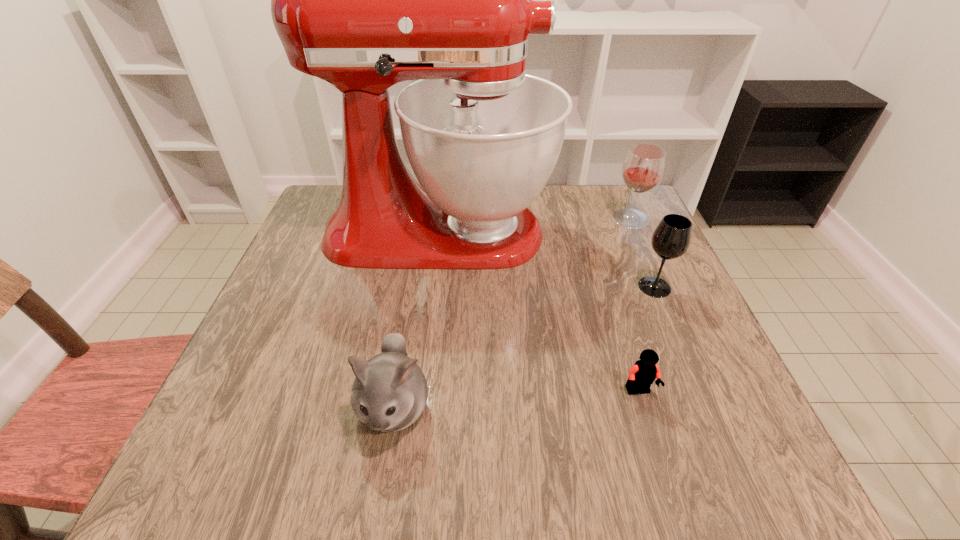
You are a GUI agent. You are given a task and a screenshot of the screen. Output one action in this format:
    pyautogui.click(x=<x>, y=<y>)
    Task: Click on the free point between the hamster and the mixer
    The image size is (960, 540).
    Given the screenshot: What is the action you would take?
    pyautogui.click(x=417, y=320)

The width and height of the screenshot is (960, 540). Find the location of `the third closest object to the nearer wineglass`. the third closest object to the nearer wineglass is located at coordinates click(x=644, y=372).

Locate which object ranks fourth in proximity to the nearer wineglass. Please provide its 2D coordinates. Your answer should be formatted as a tuple, i.e. [(x, y)], where the tuple contains the x and y coordinates of a point satisfying the conditions above.

[(389, 393)]

You are a GUI agent. You are given a task and a screenshot of the screen. Output one action in this format:
    pyautogui.click(x=<x>, y=<y>)
    Task: Click on the vacant area in the image that satisfies the following two spatial constraints: 1. at the attachment hub of the tallest object; 2. on the face of the fourth tallest object
    
    Given the screenshot: What is the action you would take?
    pyautogui.click(x=419, y=407)

The width and height of the screenshot is (960, 540). What are the coordinates of `vacant region that satisfies the following two spatial constraints: 1. on the front side of the farther wineglass; 2. at the attachment hub of the tallest object` in the screenshot? It's located at (636, 233).

Identify the location of free spot that satisfies the following two spatial constraints: 1. at the attachment hub of the mixer; 2. on the face of the hamster. (419, 407).

You are a GUI agent. You are given a task and a screenshot of the screen. Output one action in this format:
    pyautogui.click(x=<x>, y=<y>)
    Task: Click on the blank space that satisfies the following two spatial constraints: 1. on the front side of the farther wineglass; 2. at the attachment hub of the tallest object
    
    Given the screenshot: What is the action you would take?
    pyautogui.click(x=636, y=233)